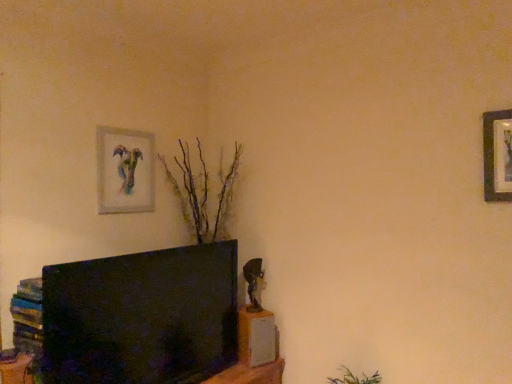
Question: Should I look upward or downward to see wooden picture frame at upper right, the 1th picture frame in the right-to-left sequence?

Choices:
 (A) down
 (B) up

Answer: (B)

Question: Would you say wooden bookshelf at lower left is a long distance from wooden picture frame at upper right, which is the 2th picture frame in left-to-right order?

Choices:
 (A) yes
 (B) no

Answer: (A)

Question: Can you confirm if wooden bookshelf at lower left is thinner than wooden picture frame at upper right, the 1th picture frame in the right-to-left sequence?

Choices:
 (A) yes
 (B) no

Answer: (B)

Question: From a real-world perspective, is wooden bookshelf at lower left located higher than wooden picture frame at upper right, the 1th picture frame in the right-to-left sequence?

Choices:
 (A) yes
 (B) no

Answer: (B)

Question: Is wooden picture frame at upper right, which is the 2th picture frame in left-to-right order, a part of wooden bookshelf at lower left?

Choices:
 (A) no
 (B) yes

Answer: (A)

Question: Would you say wooden bookshelf at lower left is outside wooden picture frame at upper right, which is the 2th picture frame in left-to-right order?

Choices:
 (A) no
 (B) yes

Answer: (B)

Question: Does wooden bookshelf at lower left have a greater width compared to wooden picture frame at upper right, the 1th picture frame in the right-to-left sequence?

Choices:
 (A) yes
 (B) no

Answer: (A)

Question: Considering the relative positions of wooden bookshelf at lower left and watercolor paper painting at upper left, placed as the first picture frame when sorted from back to front, in the image provided, is wooden bookshelf at lower left to the left of watercolor paper painting at upper left, placed as the first picture frame when sorted from back to front, from the viewer's perspective?

Choices:
 (A) yes
 (B) no

Answer: (A)

Question: Is wooden bookshelf at lower left outside of watercolor paper painting at upper left, arranged as the 2th picture frame when viewed from the front?

Choices:
 (A) yes
 (B) no

Answer: (A)

Question: Is watercolor paper painting at upper left, placed as the first picture frame when sorted from back to front, located within wooden bookshelf at lower left?

Choices:
 (A) yes
 (B) no

Answer: (B)

Question: From a real-world perspective, does wooden bookshelf at lower left sit lower than watercolor paper painting at upper left, placed as the first picture frame when sorted from back to front?

Choices:
 (A) no
 (B) yes

Answer: (B)

Question: Does wooden bookshelf at lower left have a larger size compared to watercolor paper painting at upper left, the second picture frame in the right-to-left sequence?

Choices:
 (A) no
 (B) yes

Answer: (B)

Question: Are wooden bookshelf at lower left and watercolor paper painting at upper left, the 1th picture frame in the left-to-right sequence, beside each other?

Choices:
 (A) no
 (B) yes

Answer: (A)

Question: Is wooden picture frame at upper right, which is the 2th picture frame in left-to-right order, further to the viewer compared to watercolor paper painting at upper left, arranged as the 2th picture frame when viewed from the front?

Choices:
 (A) yes
 (B) no

Answer: (B)